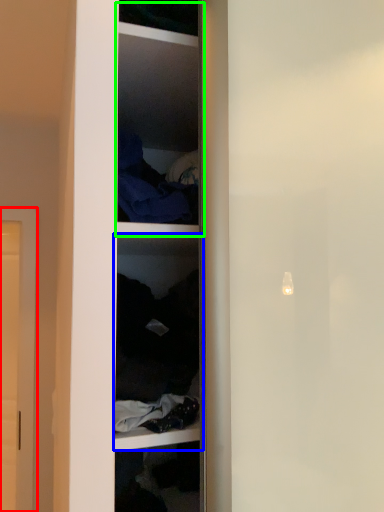
Question: Which object is the closest to the door (highlighted by a red box)? Choose among these: shelf (highlighted by a blue box) or cabinet (highlighted by a green box).

Choices:
 (A) shelf
 (B) cabinet

Answer: (A)